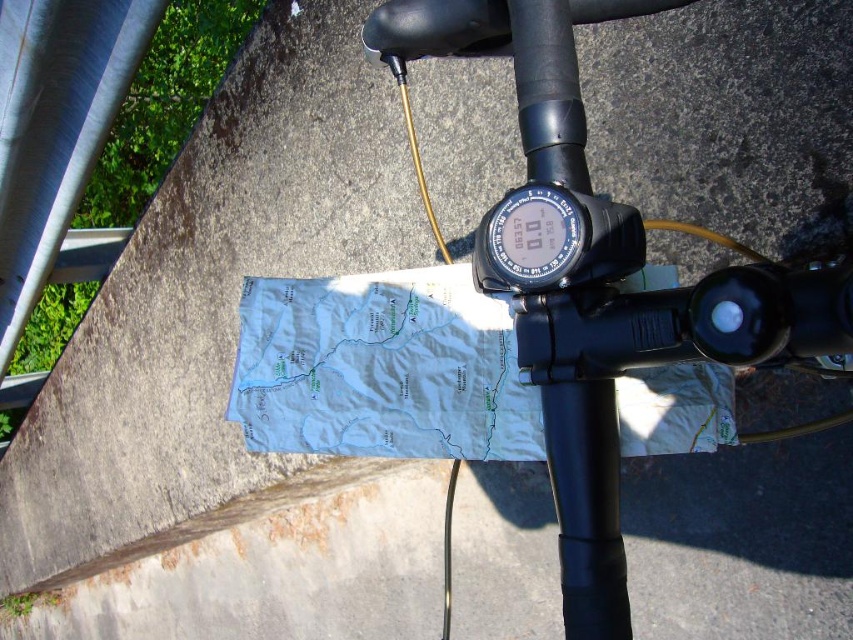
Does black matte bicycle handlebar at center have a lesser height compared to black plastic gauge at center?

Incorrect, black matte bicycle handlebar at center's height does not fall short of black plastic gauge at center's.

Who is taller, black matte bicycle handlebar at center or black plastic gauge at center?

black matte bicycle handlebar at center is taller.

What do you see at coordinates (602, 282) in the screenshot?
I see `black matte bicycle handlebar at center` at bounding box center [602, 282].

This screenshot has width=853, height=640. What are the coordinates of `black matte bicycle handlebar at center` in the screenshot? It's located at (602, 282).

Can you confirm if black matte handlebar at center is taller than black plastic gauge at center?

Indeed, black matte handlebar at center has a greater height compared to black plastic gauge at center.

Which is more to the right, black matte handlebar at center or black plastic gauge at center?

black matte handlebar at center is more to the right.

Is point (567, 624) positioned behind point (558, 234)?

Yes.

Identify the location of black matte handlebar at center. (585, 504).

Is black matte bicycle handlebar at center in front of black matte handlebar at center?

Yes, it is.

Who is more distant from viewer, (582, 573) or (581, 182)?

The point (581, 182) is behind.

The width and height of the screenshot is (853, 640). I want to click on black matte bicycle handlebar at center, so click(x=602, y=282).